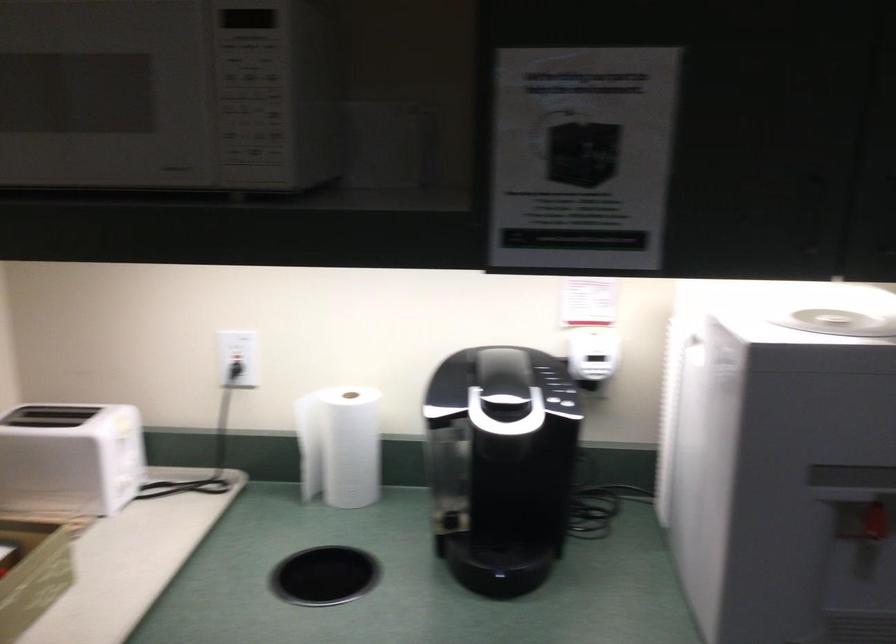
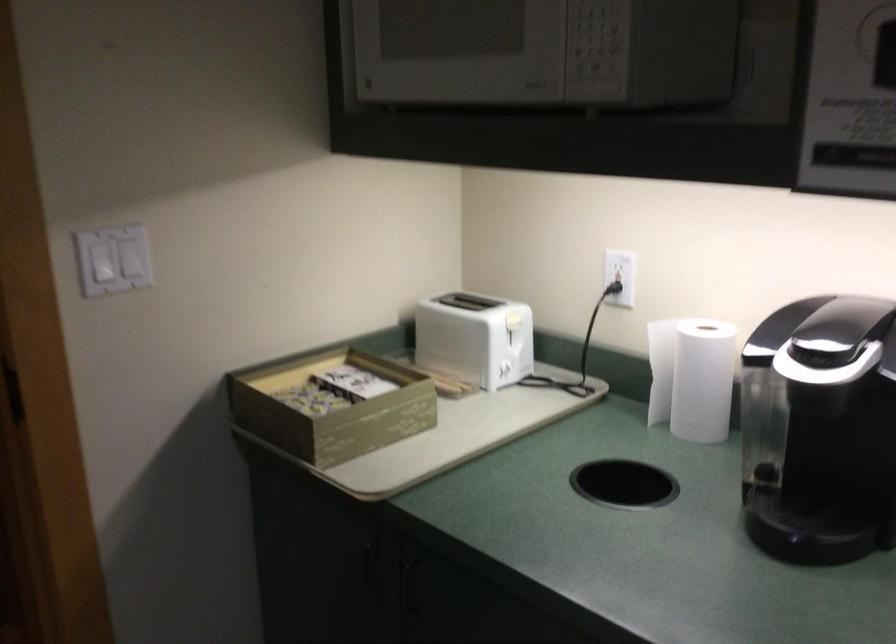
Where in the second image is the point corresponding to point 359,448 from the first image?

(702, 380)